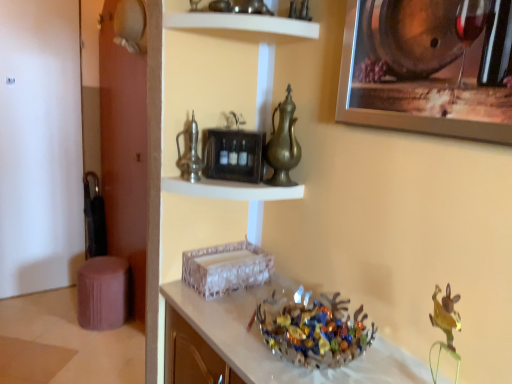
Find the location of a particular element. This screenshot has height=384, width=512. vacant space in front of purple fabric stool at lower left is located at coordinates (84, 347).